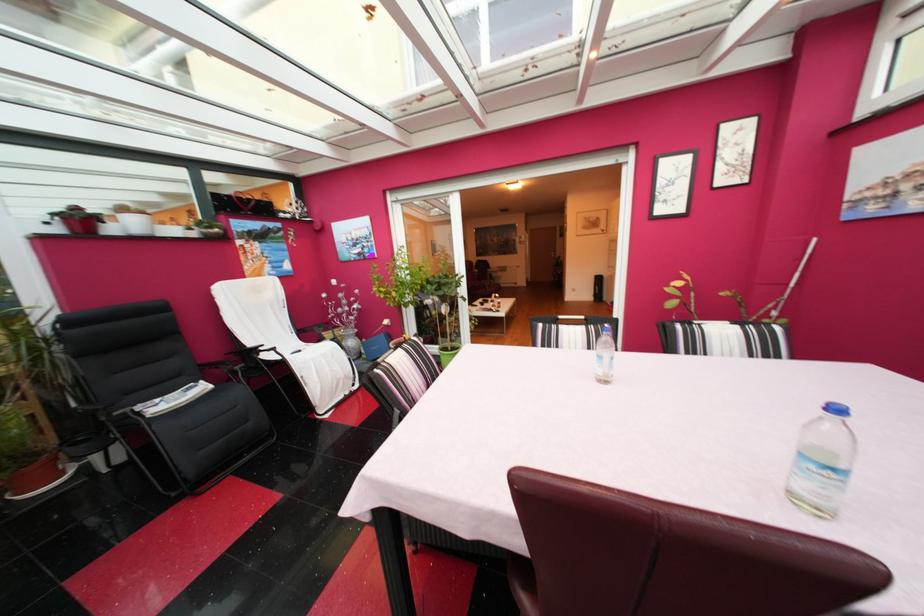
Find where to lift the green plant pot. Please return your answer as a coordinate pair (x, y).

(447, 352)